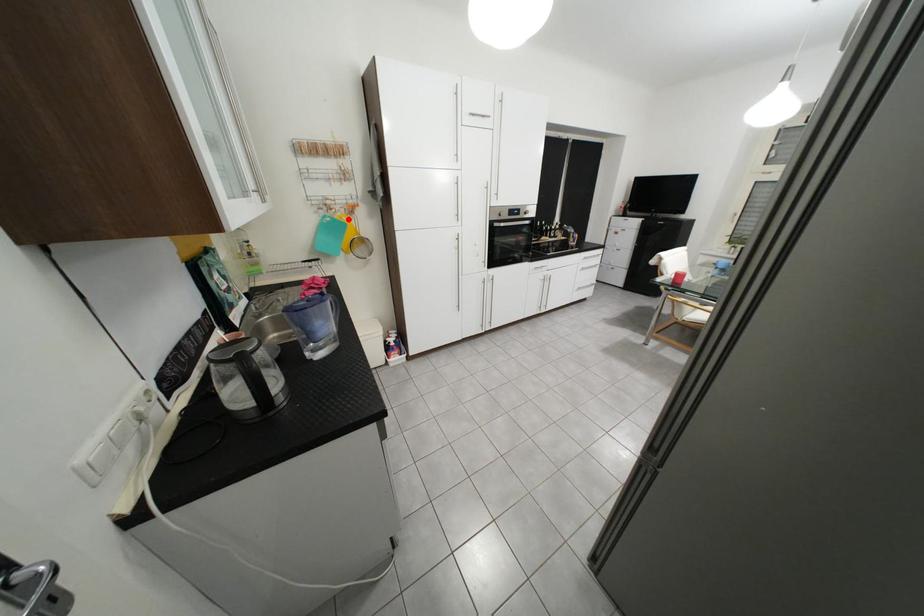
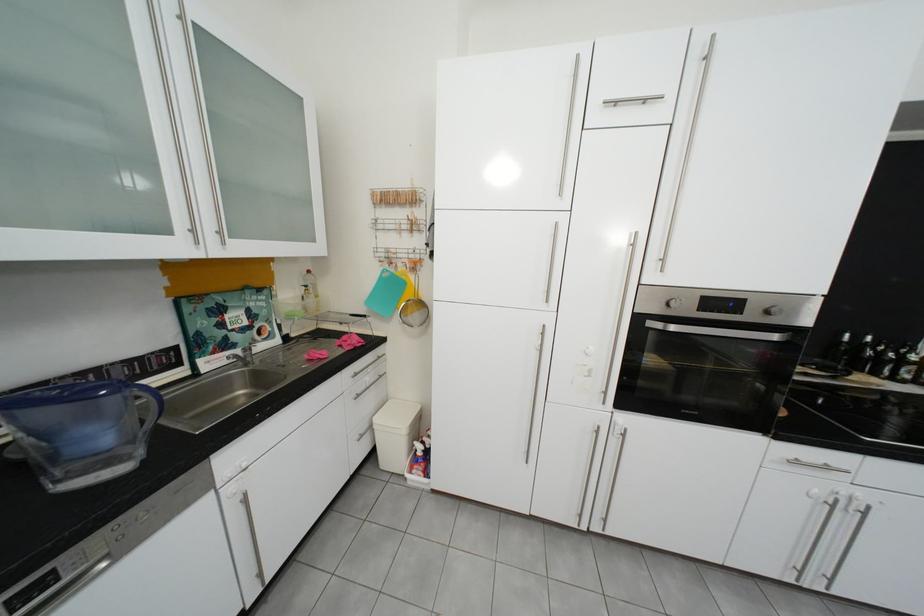
Where in the second image is the point corresponding to the highlighted location from the first image?

(409, 275)